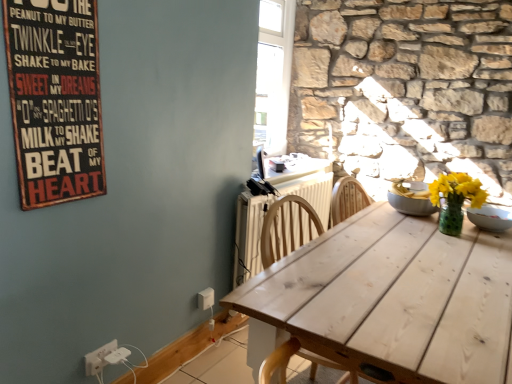
Question: From the image's perspective, is white plastic electric outlet at lower center, the second electric outlet from the left, located beneath white wood table at center?

Choices:
 (A) yes
 (B) no

Answer: (A)

Question: Considering the relative positions of white plastic electric outlet at lower center, which appears as the 1th electric outlet when viewed from the right, and white wood table at center in the image provided, is white plastic electric outlet at lower center, which appears as the 1th electric outlet when viewed from the right, in front of white wood table at center?

Choices:
 (A) yes
 (B) no

Answer: (B)

Question: Is white plastic electric outlet at lower center, which appears as the 1th electric outlet when viewed from the right, to the left of white wood table at center from the viewer's perspective?

Choices:
 (A) no
 (B) yes

Answer: (B)

Question: Is white plastic electric outlet at lower center, which is counted as the 2th electric outlet, starting from the front, to the right of white wood table at center from the viewer's perspective?

Choices:
 (A) yes
 (B) no

Answer: (B)

Question: Is white plastic electric outlet at lower center, which is counted as the 2th electric outlet, starting from the front, taller than white wood table at center?

Choices:
 (A) no
 (B) yes

Answer: (A)

Question: Considering their positions, is white plastic electric outlet at lower left, placed as the 2th electric outlet when sorted from top to bottom, located in front of or behind wooden signboard at upper left?

Choices:
 (A) behind
 (B) front

Answer: (A)

Question: From a real-world perspective, is white plastic electric outlet at lower left, which appears as the 1th electric outlet when viewed from the front, physically located above or below wooden signboard at upper left?

Choices:
 (A) above
 (B) below

Answer: (B)

Question: Based on their sizes in the image, would you say white plastic electric outlet at lower left, which is the 2th electric outlet in right-to-left order, is bigger or smaller than wooden signboard at upper left?

Choices:
 (A) small
 (B) big

Answer: (A)

Question: From the image's perspective, is white plastic electric outlet at lower left, which ranks as the 1th electric outlet in bottom-to-top order, above or below wooden signboard at upper left?

Choices:
 (A) above
 (B) below

Answer: (B)

Question: Considering the positions of white glossy bowl at upper right and wooden signboard at upper left in the image, is white glossy bowl at upper right taller or shorter than wooden signboard at upper left?

Choices:
 (A) short
 (B) tall

Answer: (A)

Question: Considering the positions of point (486, 208) and point (19, 43), is point (486, 208) closer or farther from the camera than point (19, 43)?

Choices:
 (A) closer
 (B) farther

Answer: (B)

Question: From the image's perspective, is white glossy bowl at upper right positioned above or below wooden signboard at upper left?

Choices:
 (A) above
 (B) below

Answer: (B)

Question: From a real-world perspective, is white glossy bowl at upper right above or below wooden signboard at upper left?

Choices:
 (A) above
 (B) below

Answer: (B)

Question: From a real-world perspective, relative to white wood table at center, is white painted radiator at center vertically above or below?

Choices:
 (A) above
 (B) below

Answer: (B)

Question: Relative to white wood table at center, is white painted radiator at center in front or behind?

Choices:
 (A) front
 (B) behind

Answer: (B)